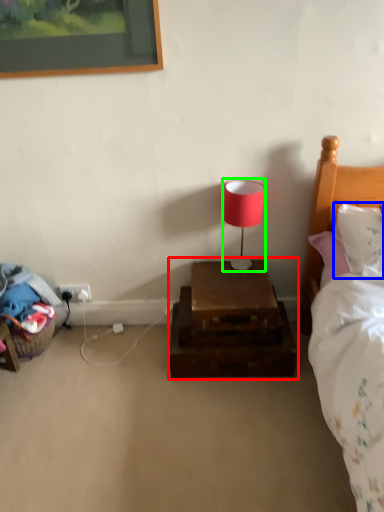
Question: Which object is positioned farthest from nightstand (highlighted by a red box)? Select from pillow (highlighted by a blue box) and table lamp (highlighted by a green box).

Choices:
 (A) pillow
 (B) table lamp

Answer: (A)